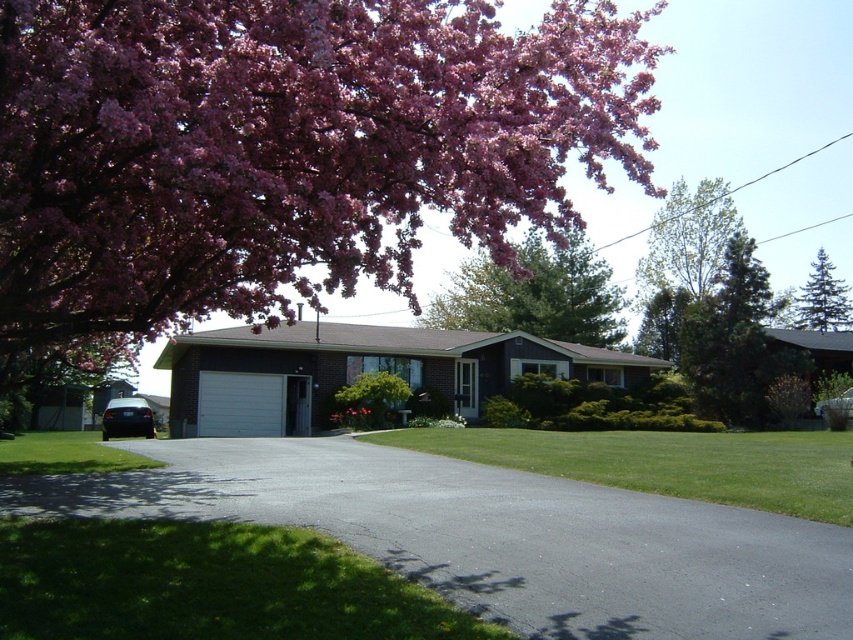
You are planning to park your car in the suburban area shown. The car requires a space larger than the green textured pine tree at right. Can the black asphalt driveway at center accommodate your car?

The black asphalt driveway at center is smaller than the green textured pine tree at right, so it cannot accommodate a car requiring a space larger than the green textured pine tree at right.

You are standing in the front yard of the house and want to take a photo of the pink bloom at upper left. Where should you position yourself to capture the bloom in the frame?

To capture the pink bloom at upper left in the frame, position yourself so that the bloom is centered at coordinates approximately 0.233 on the horizontal axis and 0.335 on the vertical axis relative to the image frame.

You are a gardener standing in front of the house. You see the pink bloom at upper left and the pink matte flower at center. Which flower is closer to you?

The pink bloom at upper left is closer to you because it is in front of the pink matte flower at center.